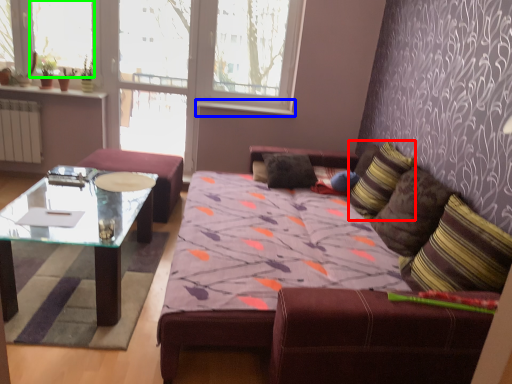
Question: Which is farther away from pillow (highlighted by a red box)? window sill (highlighted by a blue box) or window screen (highlighted by a green box)?

Choices:
 (A) window sill
 (B) window screen

Answer: (B)